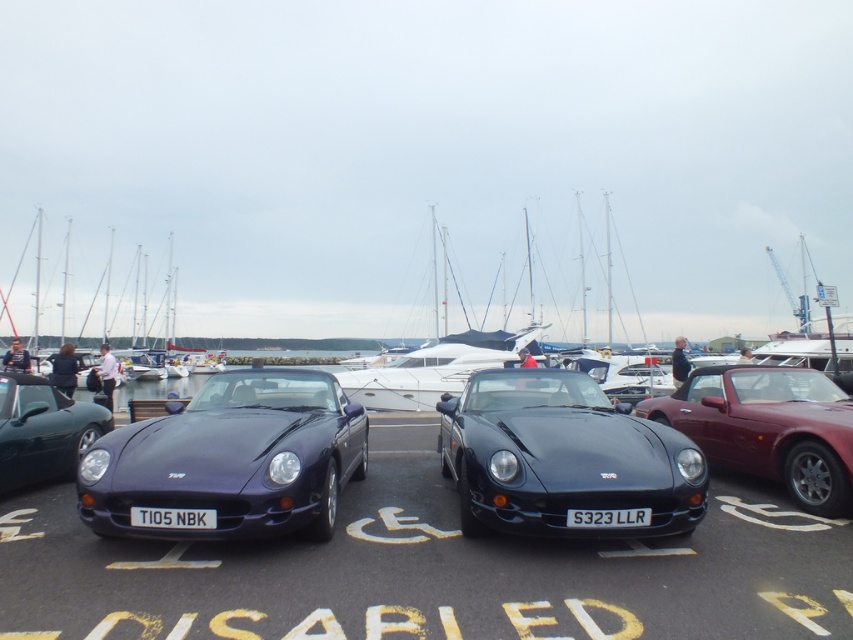
Question: Which point is closer to the camera?

Choices:
 (A) (250, 372)
 (B) (67, 461)
 (C) (103, 332)

Answer: (A)

Question: Does matte black sports car at center appear on the left side of shiny dark green convertible at left?

Choices:
 (A) no
 (B) yes

Answer: (A)

Question: Is matte black car at center bigger than black plastic license plate at center?

Choices:
 (A) no
 (B) yes

Answer: (B)

Question: Estimate the real-world distances between objects in this image. Which object is farther from the matte black car at center?

Choices:
 (A) shiny dark green convertible at left
 (B) white glossy sailboat at left
 (C) white glossy boat at center
 (D) shiny maroon convertible at center

Answer: (B)

Question: Which point is closer to the camera?

Choices:
 (A) black glossy sports car at center
 (B) shiny maroon convertible at center
 (C) white plastic license plate at center
 (D) shiny dark green convertible at left

Answer: (C)

Question: Can you confirm if black glossy sports car at center is positioned below shiny dark green convertible at left?

Choices:
 (A) yes
 (B) no

Answer: (A)